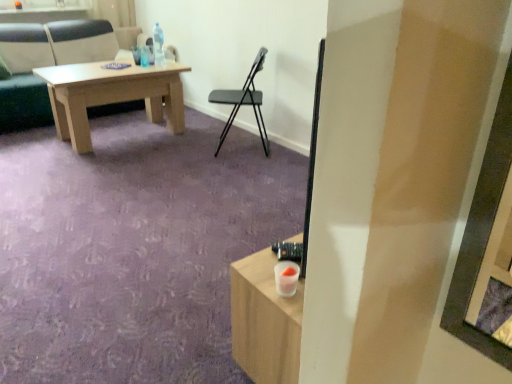
Locate an element on the screen. vacant location below black plastic chair at center, which ranks as the first chair in front-to-back order (from a real-world perspective) is located at coordinates (237, 145).